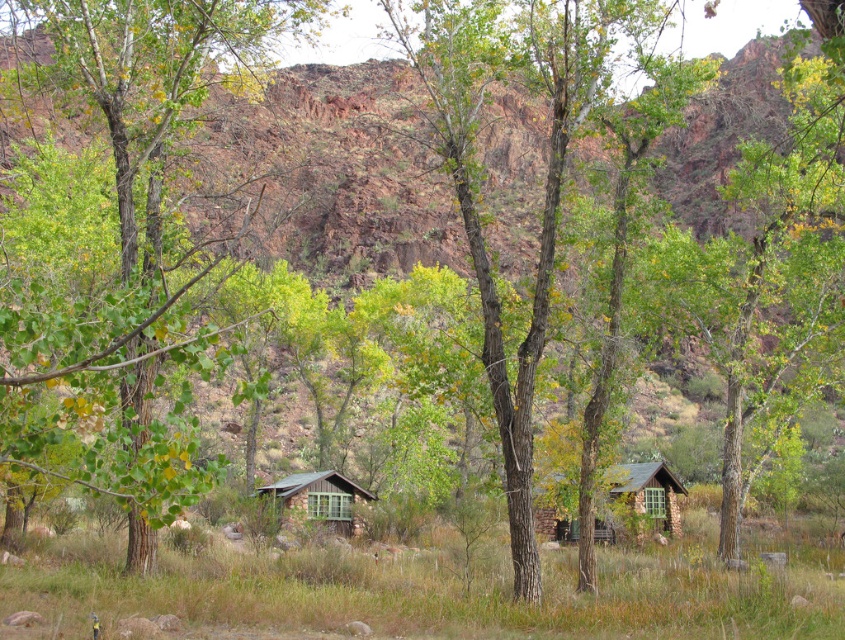
Question: Which point appears closest to the camera in this image?

Choices:
 (A) (530, 4)
 (B) (61, 42)
 (C) (669, 522)

Answer: (A)

Question: Can you confirm if green leafy tree at left is bigger than wooden cabin at center?

Choices:
 (A) no
 (B) yes

Answer: (B)

Question: Which object is farther from the camera taking this photo?

Choices:
 (A) wooden cabin at center
 (B) smooth bark tree at center

Answer: (A)

Question: Which object is farther from the camera taking this photo?

Choices:
 (A) wooden cabin at center
 (B) rustic stone cabin at center
 (C) green leafy tree at left
 (D) smooth bark tree at center

Answer: (A)

Question: Is green leafy tree at left positioned at the back of wooden cabin at center?

Choices:
 (A) no
 (B) yes

Answer: (A)

Question: Does green leafy tree at left come behind smooth bark tree at center?

Choices:
 (A) no
 (B) yes

Answer: (A)